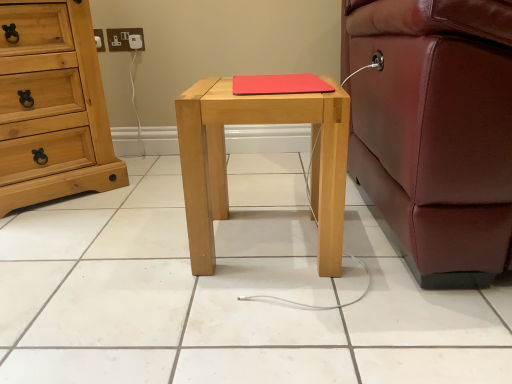
This screenshot has width=512, height=384. I want to click on free space between light brown wooden chest of drawers at left and light wood/texture nightstand at center, so click(139, 213).